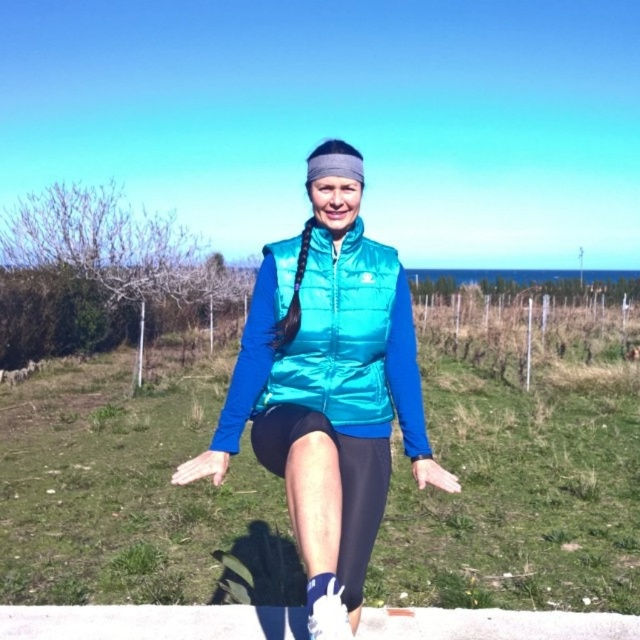
You are a drone operator trying to capture a photo of the person in the image. You need to ensure that both points, point (316, 372) and point (388, 413), are clearly visible in the frame. Based on their positions, which point is closer to the camera and should be prioritized to avoid being obscured by the fence?

Point (316, 372) is closer to the viewer than point (388, 413), so it should be prioritized to avoid being obscured by the fence.

The person in the image is wearing two vests. Which one is closer to the viewer, the metallic teal vest at center or the teal quilted vest at center?

The metallic teal vest at center is positioned under the teal quilted vest at center, so the teal quilted vest at center is closer to the viewer.

You are a fashion designer observing the person in the image. You need to determine if the teal quilted vest at center is visible over the black spandex leggings at center. Based on the scene description, can you confirm this?

Yes, the teal quilted vest at center is positioned over the black spandex leggings at center, so it is visible over them.